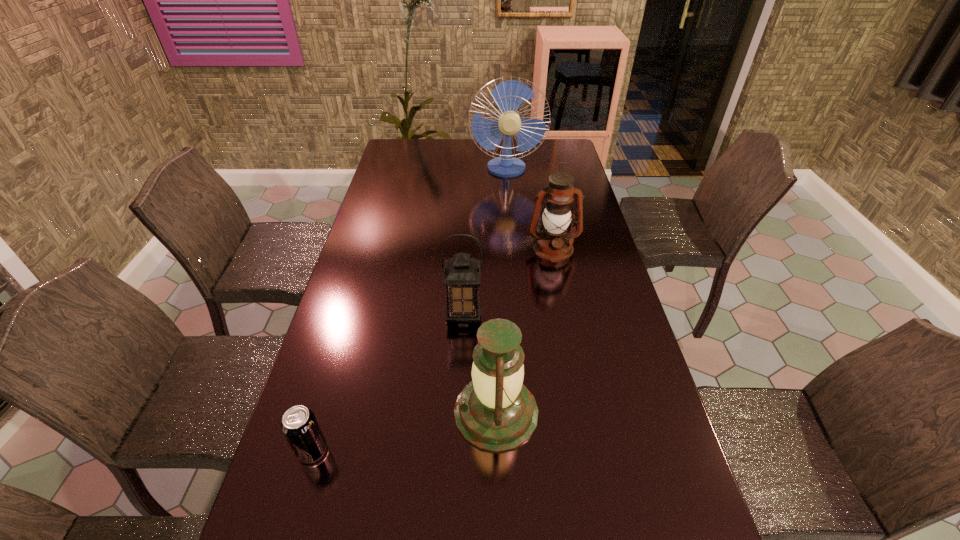
Find the location of a particular element. The image size is (960, 540). the tallest object is located at coordinates (509, 95).

Locate an element on the screen. This screenshot has width=960, height=540. the farthest object is located at coordinates (509, 95).

You are a GUI agent. You are given a task and a screenshot of the screen. Output one action in this format:
    pyautogui.click(x=<x>, y=<y>)
    Task: Click on the fourth nearest object
    
    Given the screenshot: What is the action you would take?
    pyautogui.click(x=553, y=243)

This screenshot has height=540, width=960. Identify the location of the rightmost lantern. (553, 243).

You are a GUI agent. You are given a task and a screenshot of the screen. Output one action in this format:
    pyautogui.click(x=<x>, y=<y>)
    Task: Click on the second farthest lantern
    This screenshot has width=960, height=540.
    Given the screenshot: What is the action you would take?
    pyautogui.click(x=462, y=274)

This screenshot has width=960, height=540. I want to click on the nearest lantern, so click(495, 412).

In order to click on soda can in this screenshot , I will do `click(299, 425)`.

Identify the location of the leftmost object. The image size is (960, 540). (299, 425).

Locate an element on the screen. vacant space located at the front of the fan where the blades are visible is located at coordinates (512, 225).

Locate an element on the screen. The image size is (960, 540). free space located on the side of the second farthest object, there is a wick adjustment knob is located at coordinates (567, 320).